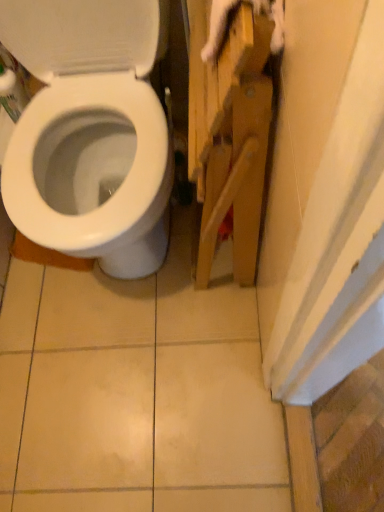
Image resolution: width=384 pixels, height=512 pixels. What do you see at coordinates (229, 134) in the screenshot?
I see `wooden cabinet at right` at bounding box center [229, 134].

This screenshot has height=512, width=384. In order to click on wooden cabinet at right in this screenshot , I will do `click(229, 134)`.

Find the location of a particular element. white glossy toilet at left is located at coordinates click(93, 173).

Describe the element at coordinates (93, 173) in the screenshot. This screenshot has height=512, width=384. I see `white glossy toilet at left` at that location.

Where is `wooden cabinet at right`? Image resolution: width=384 pixels, height=512 pixels. wooden cabinet at right is located at coordinates (229, 134).

Is wooden cabinet at right to the left or to the right of white glossy toilet at left in the image?

From the image, it's evident that wooden cabinet at right is to the right of white glossy toilet at left.

Is wooden cabinet at right positioned in front of white glossy toilet at left?

That is False.

Is point (193, 47) positioned before point (30, 181)?

Yes, point (193, 47) is in front of point (30, 181).

From the image's perspective, is wooden cabinet at right above white glossy toilet at left?

No, from the image's perspective, wooden cabinet at right is not over white glossy toilet at left.

From a real-world perspective, does wooden cabinet at right sit lower than white glossy toilet at left?

Indeed, from a real-world perspective, wooden cabinet at right is positioned beneath white glossy toilet at left.

Which object is thinner, wooden cabinet at right or white glossy toilet at left?

Thinner between the two is wooden cabinet at right.

Does wooden cabinet at right have a lesser height compared to white glossy toilet at left?

Yes.

Is wooden cabinet at right bigger or smaller than white glossy toilet at left?

Considering their sizes, wooden cabinet at right takes up less space than white glossy toilet at left.

Is wooden cabinet at right inside or outside of white glossy toilet at left?

wooden cabinet at right is located beyond the bounds of white glossy toilet at left.

Would you say wooden cabinet at right is a long distance from white glossy toilet at left?

No, wooden cabinet at right is not far from white glossy toilet at left.

Is wooden cabinet at right oriented towards white glossy toilet at left?

No, wooden cabinet at right does not turn towards white glossy toilet at left.

What are the coordinates of `cabinetry below the white glossy toilet at left (from a real-world perspective)` in the screenshot? It's located at (229, 134).

Which object is positioned more to the right, white glossy toilet at left or wooden cabinet at right?

wooden cabinet at right.

In the image, is white glossy toilet at left positioned in front of or behind wooden cabinet at right?

Visually, white glossy toilet at left is located in front of wooden cabinet at right.

Between point (123, 157) and point (195, 5), which one is positioned behind?

The point (123, 157) is more distant.

From the image's perspective, is white glossy toilet at left positioned above or below wooden cabinet at right?

white glossy toilet at left is situated higher than wooden cabinet at right in the image.

From a real-world perspective, which is physically below, white glossy toilet at left or wooden cabinet at right?

From a 3D spatial view, wooden cabinet at right is below.

Is white glossy toilet at left wider than wooden cabinet at right?

Correct, the width of white glossy toilet at left exceeds that of wooden cabinet at right.

Which of these two, white glossy toilet at left or wooden cabinet at right, stands shorter?

With less height is wooden cabinet at right.

Can you confirm if white glossy toilet at left is smaller than wooden cabinet at right?

No.

Is white glossy toilet at left completely or partially outside of wooden cabinet at right?

Yes, white glossy toilet at left is located beyond the bounds of wooden cabinet at right.

Is white glossy toilet at left in contact with wooden cabinet at right?

white glossy toilet at left and wooden cabinet at right are not in contact.

Is white glossy toilet at left facing away from wooden cabinet at right?

No, white glossy toilet at left is not facing away from wooden cabinet at right.

Where is `bidet above the wooden cabinet at right (from the image's perspective)`? bidet above the wooden cabinet at right (from the image's perspective) is located at coordinates coord(93,173).

Image resolution: width=384 pixels, height=512 pixels. Find the location of `cabinetry that appears below the white glossy toilet at left (from the image's perspective)`. cabinetry that appears below the white glossy toilet at left (from the image's perspective) is located at coordinates (229, 134).

The image size is (384, 512). Identify the location of cabinetry lying behind the white glossy toilet at left. (229, 134).